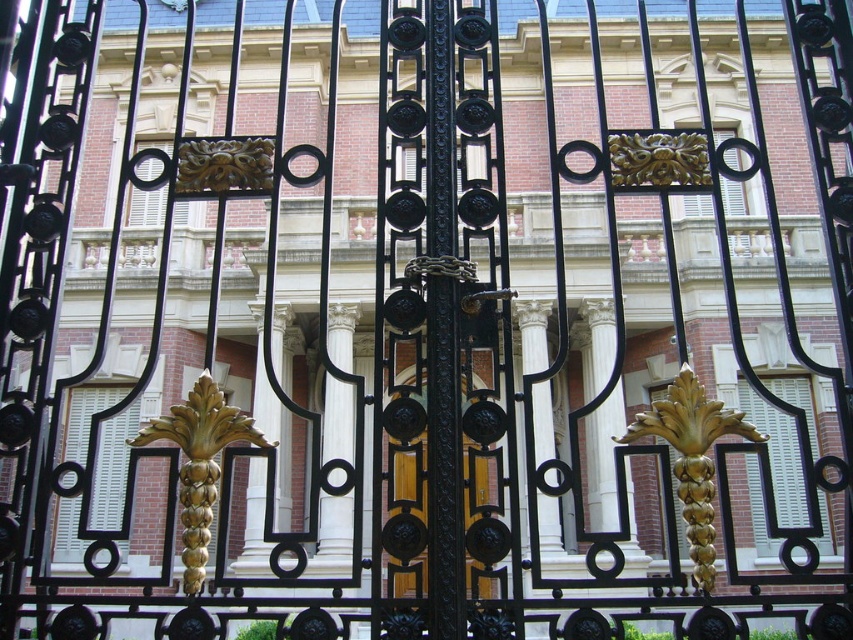
You are standing in front of the ornate wrought iron gate. You notice two points marked on the gate. One is at coordinate point (686, 532) and the other is at point (422, 397). Which point is closer to you?

Point (422, 397) is closer to you because it is in front of point (686, 532).

Looking at this image, you are a delivery person standing at the entrance of the building. You need to hand over a package to the receptionist inside. The reception desk is located 10 meters away from the wooden door at center. Can you estimate whether the goldmetallicornament at center is closer to you than the reception desk?

The goldmetallicornament at center is 8.22 meters from wooden door at center. Since the reception desk is 10 meters away from the wooden door at center, the goldmetallicornament at center is closer to you than the reception desk.

You are a visitor approaching the grand building through the wrought iron gate. You notice the goldmetallicornament at center and the wooden door at center. Which object is closer to the ground?

The goldmetallicornament at center is positioned under the wooden door at center, so the goldmetallicornament at center is closer to the ground.